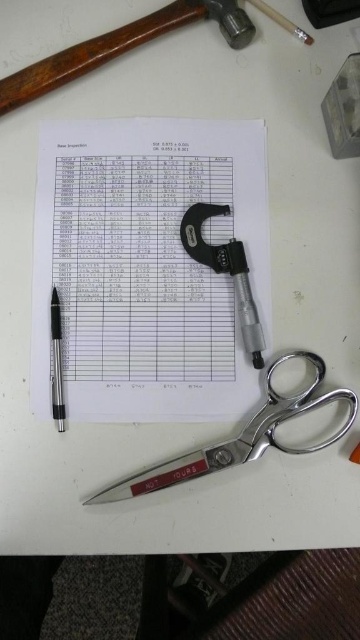
Question: Which object is farther from the camera taking this photo?

Choices:
 (A) wooden handle hammer at upper left
 (B) metallic silver pen at left
 (C) silver metallic scissors at lower center
 (D) matte black micrometer at center

Answer: (A)

Question: Which object is the closest to the matte black micrometer at center?

Choices:
 (A) silver metallic scissors at lower center
 (B) white paper at center

Answer: (B)

Question: Considering the relative positions of wooden handle hammer at upper left and matte black micrometer at center in the image provided, where is wooden handle hammer at upper left located with respect to matte black micrometer at center?

Choices:
 (A) right
 (B) left

Answer: (B)

Question: Can you confirm if silver metallic scissors at lower center is positioned to the right of metallic silver pen at left?

Choices:
 (A) yes
 (B) no

Answer: (A)

Question: Which point is farther to the camera?

Choices:
 (A) silver metallic scissors at lower center
 (B) matte black micrometer at center

Answer: (B)

Question: Considering the relative positions of white paper at center and matte black micrometer at center in the image provided, where is white paper at center located with respect to matte black micrometer at center?

Choices:
 (A) above
 (B) below

Answer: (A)